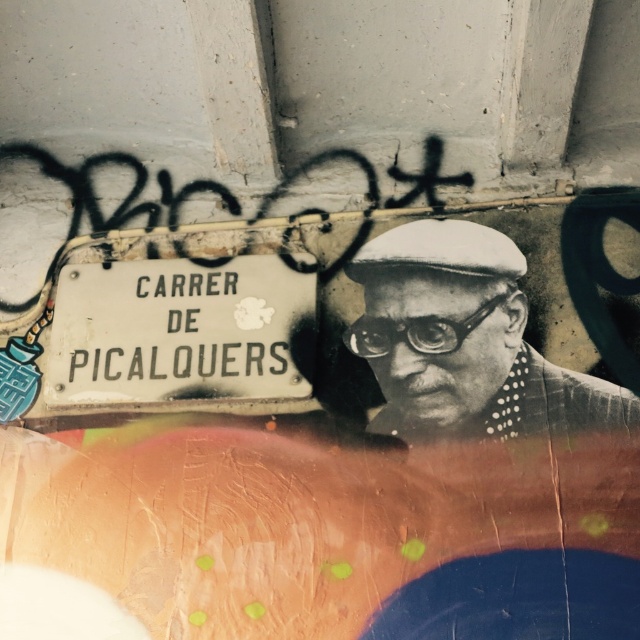
Can you confirm if black textured hat at center is positioned to the right of white matte street sign at center?

Yes, black textured hat at center is to the right of white matte street sign at center.

Does black textured hat at center appear on the left side of white matte street sign at center?

In fact, black textured hat at center is to the right of white matte street sign at center.

Locate an element on the screen. This screenshot has width=640, height=640. black textured hat at center is located at coordinates (465, 342).